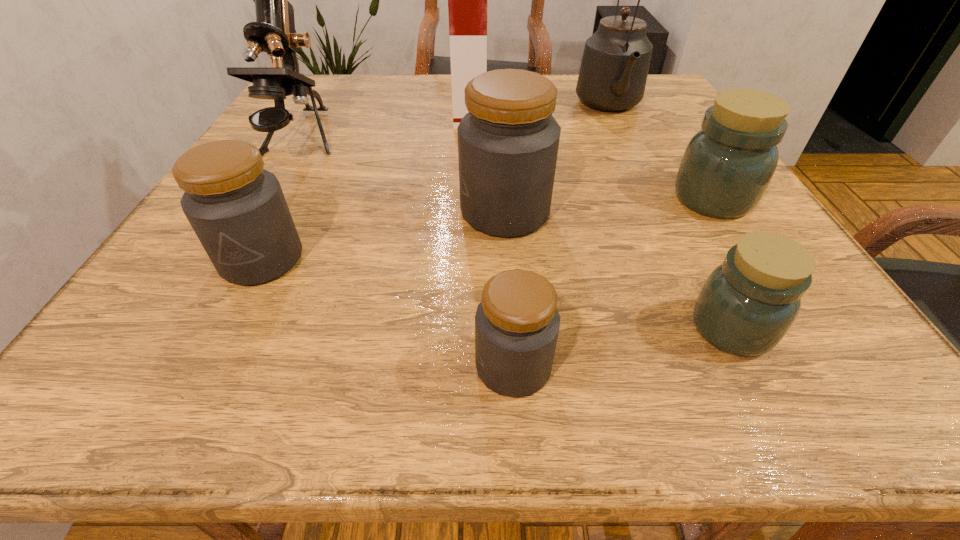
Find the location of `free region located on the surface of the smallest gray jar near the warning symbol`. free region located on the surface of the smallest gray jar near the warning symbol is located at coordinates (187, 366).

The width and height of the screenshot is (960, 540). What are the coordinates of `free space located on the surface of the smallest gray jar near the warning symbol` in the screenshot? It's located at (387, 366).

Where is `microscope that is at the far edge`? The image size is (960, 540). microscope that is at the far edge is located at coordinates click(x=273, y=32).

The image size is (960, 540). I want to click on cigarette_case located at the far edge, so click(x=467, y=0).

The height and width of the screenshot is (540, 960). I want to click on kettle at the far edge, so click(x=613, y=73).

Locate an element on the screen. This screenshot has height=540, width=960. microscope that is at the left edge is located at coordinates (273, 32).

At what (x,y) coordinates should I click in order to perform the action: click on jar that is at the left edge. Please return your answer as a coordinate pair (x, y). This screenshot has width=960, height=540. Looking at the image, I should click on (237, 209).

I want to click on kettle present at the right edge, so click(x=613, y=73).

Locate an element on the screen. object present at the far left corner is located at coordinates (273, 32).

Where is `object located in the far right corner section of the desktop`? The image size is (960, 540). object located in the far right corner section of the desktop is located at coordinates click(613, 73).